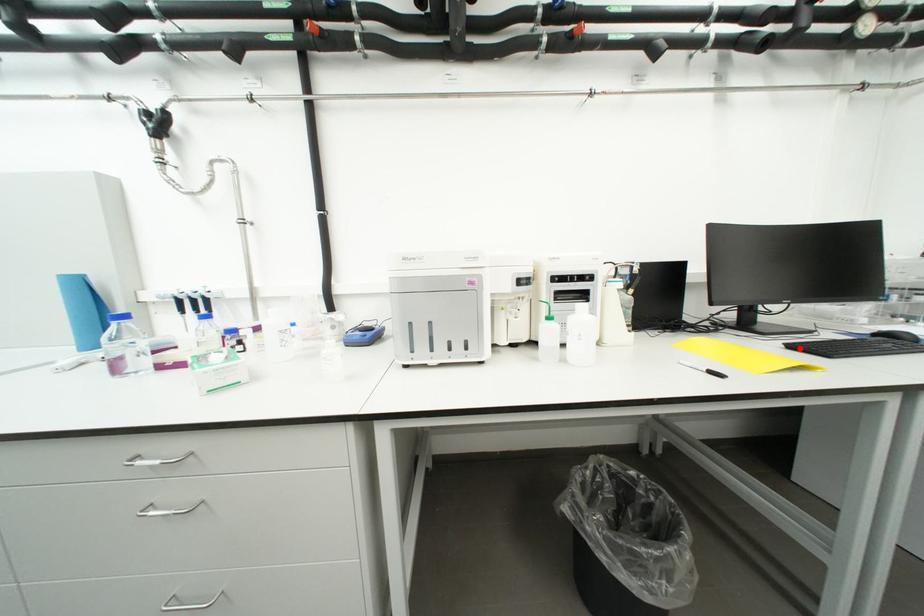
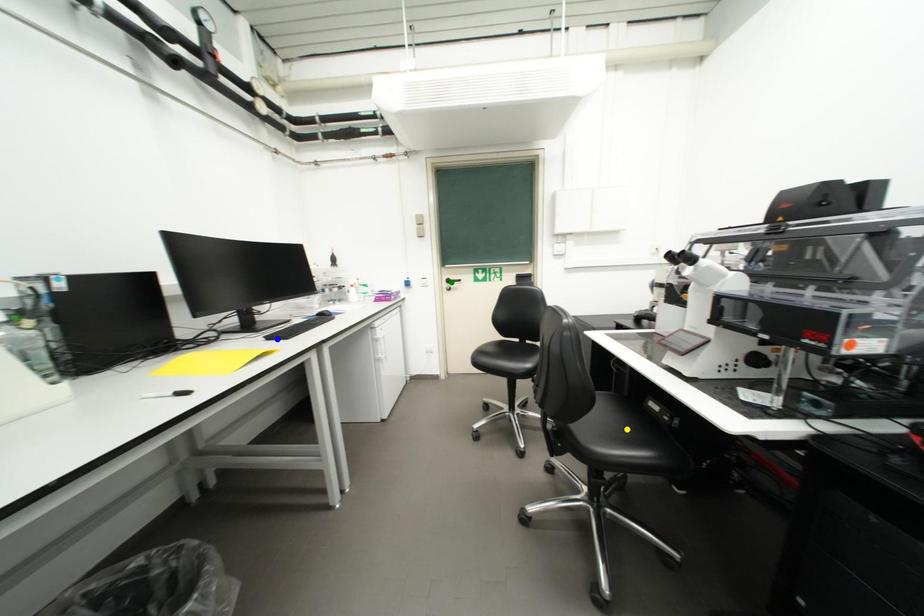
Question: I am providing you with two images of the same scene from different viewpoints. A red point is marked on the first image. You are given multiple points on the second image. Which mark in image 2 goes with the point in image 1?

Choices:
 (A) blue point
 (B) green point
 (C) yellow point

Answer: (A)